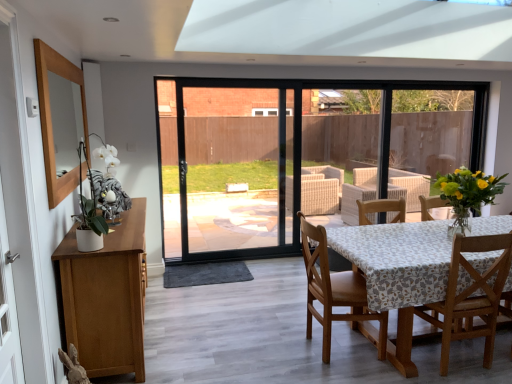
Question: From a real-world perspective, is wooden mirror at left positioned above or below white ceramic vase at left, arranged as the 1th floral arrangement when viewed from the front?

Choices:
 (A) below
 (B) above

Answer: (A)

Question: Is wooden mirror at left wider or thinner than white ceramic vase at left, arranged as the 1th floral arrangement when viewed from the front?

Choices:
 (A) wide
 (B) thin

Answer: (B)

Question: Considering the real-world distances, which object is farthest from the yellow fabric vase at right, the 1th floral arrangement positioned from the back?

Choices:
 (A) white ceramic vase at left, placed as the second floral arrangement when sorted from right to left
 (B) wooden chair at lower right, arranged as the 1th chair when viewed from the right
 (C) wooden chair at center, the 2th chair from the right
 (D) wooden mirror at left

Answer: (D)

Question: Considering the real-world distances, which object is farthest from the white ceramic vase at left, marked as the 2th floral arrangement in a back-to-front arrangement?

Choices:
 (A) wooden chair at lower right, arranged as the 1th chair when viewed from the right
 (B) wooden mirror at left
 (C) yellow fabric vase at right, the 2th floral arrangement when ordered from left to right
 (D) wooden chair at center, the 2th chair from the right

Answer: (C)